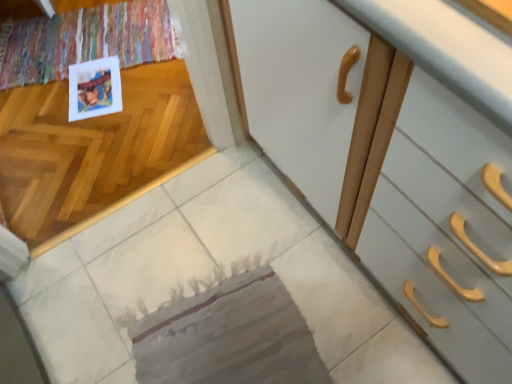
The image size is (512, 384). In order to click on matte paper postcard at upper left in this screenshot , I will do `click(94, 88)`.

What do you see at coordinates (94, 88) in the screenshot? Image resolution: width=512 pixels, height=384 pixels. I see `matte paper postcard at upper left` at bounding box center [94, 88].

The image size is (512, 384). What do you see at coordinates (229, 337) in the screenshot? I see `textured gray mat at center` at bounding box center [229, 337].

Find the location of a particular element. The height and width of the screenshot is (384, 512). textured gray mat at center is located at coordinates (229, 337).

Image resolution: width=512 pixels, height=384 pixels. Identify the location of matte paper postcard at upper left. (94, 88).

Based on their positions, is matte paper postcard at upper left located to the left or right of textured gray mat at center?

Based on their positions, matte paper postcard at upper left is located to the left of textured gray mat at center.

Is matte paper postcard at upper left positioned in front of textured gray mat at center?

No, it is not.

Is point (115, 102) positioned before point (232, 317)?

No, it is not.

In the scene shown: From the image's perspective, which one is positioned higher, matte paper postcard at upper left or textured gray mat at center?

matte paper postcard at upper left.

From a real-world perspective, relative to textured gray mat at center, is matte paper postcard at upper left vertically above or below?

From a real-world perspective, matte paper postcard at upper left is physically below textured gray mat at center.

Considering the sizes of objects matte paper postcard at upper left and textured gray mat at center in the image provided, who is wider, matte paper postcard at upper left or textured gray mat at center?

textured gray mat at center is wider.

Which of these two, matte paper postcard at upper left or textured gray mat at center, stands taller?

Standing taller between the two is matte paper postcard at upper left.

Is matte paper postcard at upper left bigger than textured gray mat at center?

No.

Choose the correct answer: Is matte paper postcard at upper left inside textured gray mat at center or outside it?

matte paper postcard at upper left lies outside textured gray mat at center.

Does matte paper postcard at upper left touch textured gray mat at center?

No, matte paper postcard at upper left is not touching textured gray mat at center.

Is matte paper postcard at upper left oriented towards textured gray mat at center?

Yes, matte paper postcard at upper left is turned towards textured gray mat at center.

Can you tell me how much matte paper postcard at upper left and textured gray mat at center differ in facing direction?

171 degrees.

Measure the distance between matte paper postcard at upper left and textured gray mat at center.

A distance of 38.60 inches exists between matte paper postcard at upper left and textured gray mat at center.

You are a GUI agent. You are given a task and a screenshot of the screen. Output one action in this format:
    pyautogui.click(x=<x>, y=<y>)
    Task: Click on the mat that is above the matte paper postcard at upper left (from a real-world perspective)
    This screenshot has width=512, height=384.
    Given the screenshot: What is the action you would take?
    pyautogui.click(x=229, y=337)

Which object is positioned more to the right, textured gray mat at center or matte paper postcard at upper left?

textured gray mat at center is more to the right.

Is textured gray mat at center positioned in front of matte paper postcard at upper left?

Yes, it is.

Is point (204, 312) positioned in front of point (120, 96)?

Yes, point (204, 312) is in front of point (120, 96).

From the image's perspective, between textured gray mat at center and matte paper postcard at upper left, who is located below?

textured gray mat at center is shown below in the image.

From a real-world perspective, is textured gray mat at center positioned over matte paper postcard at upper left based on gravity?

Yes.

Which object is thinner, textured gray mat at center or matte paper postcard at upper left?

Thinner between the two is matte paper postcard at upper left.

Who is shorter, textured gray mat at center or matte paper postcard at upper left?

textured gray mat at center is shorter.

Considering the relative sizes of textured gray mat at center and matte paper postcard at upper left in the image provided, is textured gray mat at center smaller than matte paper postcard at upper left?

Actually, textured gray mat at center might be larger than matte paper postcard at upper left.

Could matte paper postcard at upper left be considered to be inside textured gray mat at center?

No, textured gray mat at center does not contain matte paper postcard at upper left.

Are textured gray mat at center and matte paper postcard at upper left far apart?

No, textured gray mat at center is in close proximity to matte paper postcard at upper left.

Does textured gray mat at center turn towards matte paper postcard at upper left?

Yes, textured gray mat at center is aimed at matte paper postcard at upper left.

This screenshot has width=512, height=384. What are the coordinates of `mat in front of the matte paper postcard at upper left` in the screenshot? It's located at (229, 337).

Find the location of a particular element. The width and height of the screenshot is (512, 384). mat on the right of matte paper postcard at upper left is located at coordinates (229, 337).

Find the location of `postcard above the textured gray mat at center (from the image's perspective)`. postcard above the textured gray mat at center (from the image's perspective) is located at coordinates (94, 88).